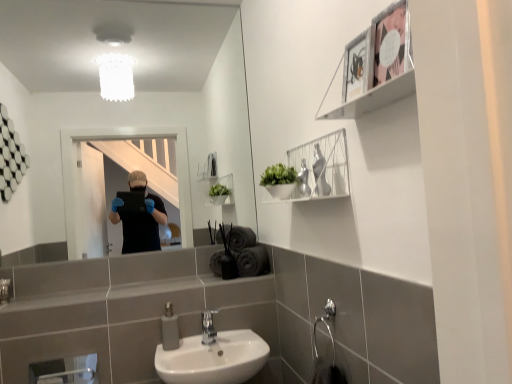
This screenshot has width=512, height=384. What do you see at coordinates (208, 327) in the screenshot? I see `satin nickel faucet at center` at bounding box center [208, 327].

Describe the element at coordinates (376, 65) in the screenshot. I see `metallic silver frame at upper right, which is the first cabinet from front to back` at that location.

Image resolution: width=512 pixels, height=384 pixels. Describe the element at coordinates (356, 66) in the screenshot. I see `metallic silver picture frame at upper right` at that location.

Measure the distance between gray matte soap dispenser at lower center and camera.

1.71 meters.

This screenshot has height=384, width=512. I want to click on gray matte soap dispenser at lower center, so click(169, 329).

What do you see at coordinates (320, 168) in the screenshot? Image resolution: width=512 pixels, height=384 pixels. I see `white wire shelf at upper center, positioned as the 2th cabinet in front-to-back order` at bounding box center [320, 168].

This screenshot has height=384, width=512. What are the coordinates of `satin nickel faucet at center` in the screenshot? It's located at (208, 327).

Can you confirm if metallic silver picture frame at upper right is bigger than clear glass mirror at upper center?

No.

In the scene shown: From the image's perspective, is metallic silver picture frame at upper right located beneath clear glass mirror at upper center?

Correct, metallic silver picture frame at upper right appears lower than clear glass mirror at upper center in the image.

Would you consider metallic silver picture frame at upper right to be distant from clear glass mirror at upper center?

Yes, metallic silver picture frame at upper right is far from clear glass mirror at upper center.

Is metallic silver picture frame at upper right oriented away from clear glass mirror at upper center?

metallic silver picture frame at upper right is not turned away from clear glass mirror at upper center.

Between point (358, 93) and point (50, 124), which one is positioned in front?

Point (358, 93)

Is metallic silver frame at upper right, the 2th cabinet positioned from the back, positioned with its back to clear glass mirror at upper center?

No.

Which of these two, metallic silver frame at upper right, which is the first cabinet from front to back, or clear glass mirror at upper center, stands shorter?

With less height is metallic silver frame at upper right, which is the first cabinet from front to back.

Could you measure the distance between gray matte soap dispenser at lower center and white wire shelf at upper center, positioned as the 2th cabinet in front-to-back order?

A distance of 35.41 inches exists between gray matte soap dispenser at lower center and white wire shelf at upper center, positioned as the 2th cabinet in front-to-back order.

Is point (168, 320) closer to camera compared to point (334, 154)?

No, it is behind (334, 154).

Would you say gray matte soap dispenser at lower center contains white wire shelf at upper center, which is counted as the 1th cabinet, starting from the back?

No, white wire shelf at upper center, which is counted as the 1th cabinet, starting from the back, is not inside gray matte soap dispenser at lower center.

Is gray matte soap dispenser at lower center at the left side of white wire shelf at upper center, placed as the second cabinet when sorted from top to bottom?

Correct, you'll find gray matte soap dispenser at lower center to the left of white wire shelf at upper center, placed as the second cabinet when sorted from top to bottom.

Between metallic silver frame at upper right, the first cabinet from the top, and gray matte soap dispenser at lower center, which one has larger width?

Wider between the two is metallic silver frame at upper right, the first cabinet from the top.

Looking at this image, from a real-world perspective, between metallic silver frame at upper right, the 2th cabinet positioned from the back, and gray matte soap dispenser at lower center, who is vertically higher?

metallic silver frame at upper right, the 2th cabinet positioned from the back, is physically above.

This screenshot has width=512, height=384. What are the coordinates of `soap dispenser lying behind the metallic silver frame at upper right, which ranks as the 2th cabinet in bottom-to-top order` in the screenshot? It's located at (169, 329).

Considering the sizes of gray matte soap dispenser at lower center and clear glass mirror at upper center in the image, is gray matte soap dispenser at lower center bigger or smaller than clear glass mirror at upper center?

gray matte soap dispenser at lower center is smaller than clear glass mirror at upper center.

Which is in front, point (163, 347) or point (59, 215)?

The point (163, 347) is more forward.

From the image's perspective, is gray matte soap dispenser at lower center under clear glass mirror at upper center?

Correct, gray matte soap dispenser at lower center appears lower than clear glass mirror at upper center in the image.

Between gray matte soap dispenser at lower center and clear glass mirror at upper center, which one has smaller width?

Thinner between the two is clear glass mirror at upper center.

Could you tell me if metallic silver picture frame at upper right is facing metallic silver frame at upper right, which is the first cabinet from front to back?

Yes, metallic silver picture frame at upper right is turned towards metallic silver frame at upper right, which is the first cabinet from front to back.

From a real-world perspective, is metallic silver picture frame at upper right above or below metallic silver frame at upper right, which is the first cabinet from front to back?

metallic silver picture frame at upper right is below metallic silver frame at upper right, which is the first cabinet from front to back.

Does metallic silver picture frame at upper right have a lesser width compared to metallic silver frame at upper right, which ranks as the 2th cabinet in bottom-to-top order?

Yes, metallic silver picture frame at upper right is thinner than metallic silver frame at upper right, which ranks as the 2th cabinet in bottom-to-top order.

Are metallic silver picture frame at upper right and metallic silver frame at upper right, which ranks as the 2th cabinet in bottom-to-top order, far apart?

metallic silver picture frame at upper right is near metallic silver frame at upper right, which ranks as the 2th cabinet in bottom-to-top order, not far away.

Is clear glass mirror at upper center not close to white wire shelf at upper center, positioned as the 2th cabinet in front-to-back order?

clear glass mirror at upper center is positioned a significant distance from white wire shelf at upper center, positioned as the 2th cabinet in front-to-back order.

Based on the photo, is clear glass mirror at upper center positioned in front of white wire shelf at upper center, which is counted as the 1th cabinet, starting from the back?

That is False.

From the image's perspective, is clear glass mirror at upper center above or below white wire shelf at upper center, placed as the second cabinet when sorted from top to bottom?

clear glass mirror at upper center is situated higher than white wire shelf at upper center, placed as the second cabinet when sorted from top to bottom, in the image.

Which cabinet is the 1st one when counting from the front of the clear glass mirror at upper center? Please provide its 2D coordinates.

[(320, 168)]

Where is `mirror above the metallic silver picture frame at upper right (from the image's perspective)`? mirror above the metallic silver picture frame at upper right (from the image's perspective) is located at coordinates (135, 126).

From the clear glass mirror at upper center, count 2nd cabinets forward and point to it. Please provide its 2D coordinates.

[(376, 65)]

From the image, which object appears to be farther from satin nickel faucet at center, metallic silver frame at upper right, the first cabinet from the top, or metallic silver picture frame at upper right?

metallic silver frame at upper right, the first cabinet from the top, is further to satin nickel faucet at center.

From the image, which object appears to be nearer to gray matte soap dispenser at lower center, satin nickel faucet at center or metallic silver picture frame at upper right?

Among the two, satin nickel faucet at center is located nearer to gray matte soap dispenser at lower center.

Based on their spatial positions, is gray matte soap dispenser at lower center or metallic silver frame at upper right, which is the first cabinet from front to back, closer to metallic silver picture frame at upper right?

The object closer to metallic silver picture frame at upper right is metallic silver frame at upper right, which is the first cabinet from front to back.

From the image, which object appears to be farther from clear glass mirror at upper center, white wire shelf at upper center, which is counted as the 1th cabinet, starting from the back, or satin nickel faucet at center?

satin nickel faucet at center.

Estimate the real-world distances between objects in this image. Which object is further from metallic silver picture frame at upper right, clear glass mirror at upper center or gray matte soap dispenser at lower center?

Among the two, clear glass mirror at upper center is located further to metallic silver picture frame at upper right.

Looking at the image, which one is located closer to satin nickel faucet at center, metallic silver frame at upper right, which is the first cabinet from front to back, or white wire shelf at upper center, placed as the second cabinet when sorted from top to bottom?

The object closer to satin nickel faucet at center is white wire shelf at upper center, placed as the second cabinet when sorted from top to bottom.

From the image, which object appears to be nearer to metallic silver frame at upper right, the first cabinet from the top, white wire shelf at upper center, positioned as the 2th cabinet in front-to-back order, or gray matte soap dispenser at lower center?

white wire shelf at upper center, positioned as the 2th cabinet in front-to-back order, is closer to metallic silver frame at upper right, the first cabinet from the top.

Consider the image. Which object lies further to the anchor point metallic silver frame at upper right, the 2th cabinet positioned from the back, gray matte soap dispenser at lower center or clear glass mirror at upper center?

clear glass mirror at upper center is positioned further to the anchor metallic silver frame at upper right, the 2th cabinet positioned from the back.

I want to click on tap located between metallic silver frame at upper right, which ranks as the 2th cabinet in bottom-to-top order, and clear glass mirror at upper center in the depth direction, so click(208, 327).

The height and width of the screenshot is (384, 512). I want to click on picture frame between metallic silver frame at upper right, the first cabinet from the top, and satin nickel faucet at center in the up-down direction, so coord(356,66).

The image size is (512, 384). Identify the location of soap dispenser between metallic silver picture frame at upper right and satin nickel faucet at center from top to bottom. (169, 329).

The width and height of the screenshot is (512, 384). What are the coordinates of `soap dispenser between white wire shelf at upper center, the first cabinet positioned from the bottom, and satin nickel faucet at center from top to bottom` in the screenshot? It's located at (169, 329).